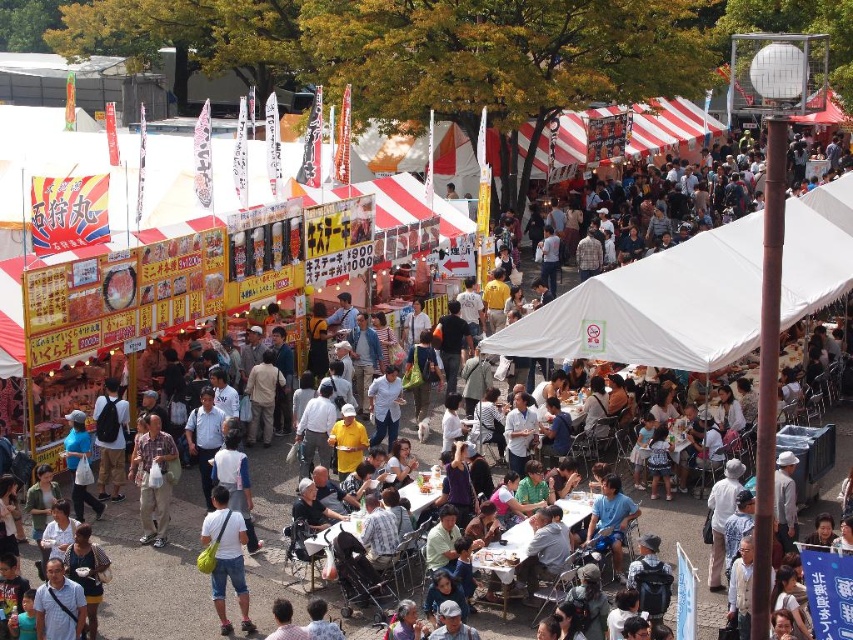
Based on the photo, between white matte shirt at center and plaid shirt at center, which one is positioned higher?

plaid shirt at center is higher up.

Between point (231, 584) and point (165, 476), which one is positioned behind?

The point (165, 476) is more distant.

At what (x,y) coordinates should I click in order to perform the action: click on white matte shirt at center. Please return your answer as a coordinate pair (x, y). Looking at the image, I should click on (225, 557).

Which is more to the right, white fabric canopy at center or white matte shirt at center?

white fabric canopy at center

Is white fabric canopy at center smaller than white matte shirt at center?

No, white fabric canopy at center is not smaller than white matte shirt at center.

Does point (498, 337) come in front of point (213, 506)?

No, (498, 337) is further to viewer.

You are a GUI agent. You are given a task and a screenshot of the screen. Output one action in this format:
    pyautogui.click(x=<x>, y=<y>)
    Task: Click on the white fabric canopy at center
    The width and height of the screenshot is (853, 640).
    Given the screenshot: What is the action you would take?
    pyautogui.click(x=656, y=307)

Between point (840, 260) and point (154, 465), which one is positioned in front?

Point (154, 465)

Which is above, white fabric canopy at center or plaid shirt at center?

white fabric canopy at center is higher up.

Which is in front, point (676, 256) or point (138, 496)?

Point (138, 496) is more forward.

Find the location of a particular element. The image size is (853, 640). white fabric canopy at center is located at coordinates (656, 307).